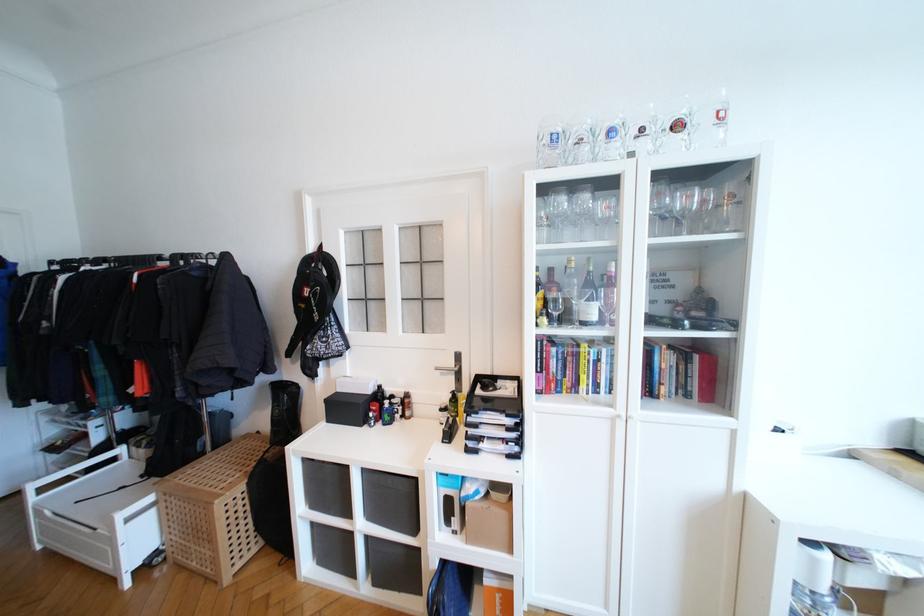
Where would you open the white bench lid? Please return your answer as a coordinate pair (x, y).

(102, 493)